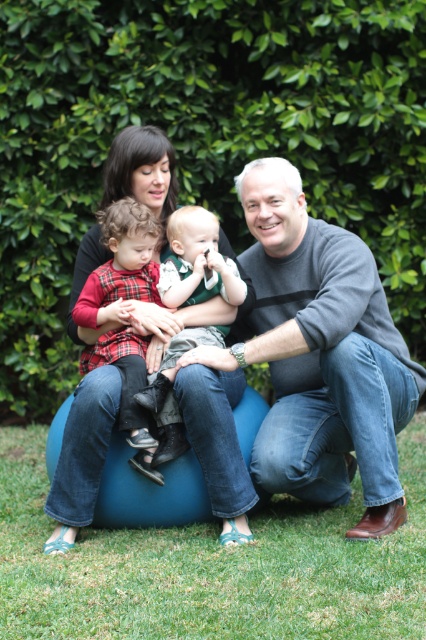
Is blue fabric bean bag at center thinner than plaid fabric shirt at left?

In fact, blue fabric bean bag at center might be wider than plaid fabric shirt at left.

Does blue fabric bean bag at center appear on the left side of plaid fabric shirt at left?

No, blue fabric bean bag at center is not to the left of plaid fabric shirt at left.

Locate an element on the screen. blue fabric bean bag at center is located at coordinates (215, 436).

Describe the element at coordinates (324, 353) in the screenshot. I see `gray sweater at center` at that location.

Consider the image. Which of these two, gray sweater at center or green textured shirt at center, stands taller?

gray sweater at center

The width and height of the screenshot is (426, 640). Find the location of `gray sweater at center`. gray sweater at center is located at coordinates (324, 353).

Between point (204, 552) and point (399, 508), which one is positioned in front?

Positioned in front is point (204, 552).

Is green grass at lower center wider than gray sweater at center?

Yes.

Image resolution: width=426 pixels, height=640 pixels. In order to click on green grass at lower center in this screenshot , I will do `click(210, 566)`.

Locate an element on the screen. The width and height of the screenshot is (426, 640). green grass at lower center is located at coordinates coord(210,566).